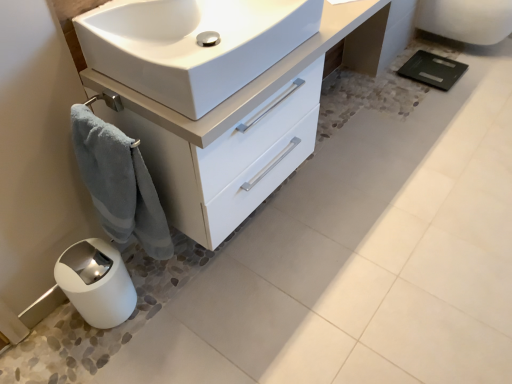
Question: Is point (437, 16) closer or farther from the camera than point (169, 34)?

Choices:
 (A) closer
 (B) farther

Answer: (B)

Question: In terms of size, does white glossy porcelain at upper right appear bigger or smaller than white glossy sink at center?

Choices:
 (A) big
 (B) small

Answer: (A)

Question: Estimate the real-world distances between objects in this image. Which object is farther from the white glossy porcelain at upper right?

Choices:
 (A) white glossy cabinet at lower left
 (B) white glossy sink at center
 (C) blue plush towel at lower left
 (D) white glossy trash can at lower left

Answer: (D)

Question: Which is nearer to the blue plush towel at lower left?

Choices:
 (A) white glossy trash can at lower left
 (B) white glossy cabinet at lower left
 (C) white glossy sink at center
 (D) white glossy porcelain at upper right

Answer: (B)